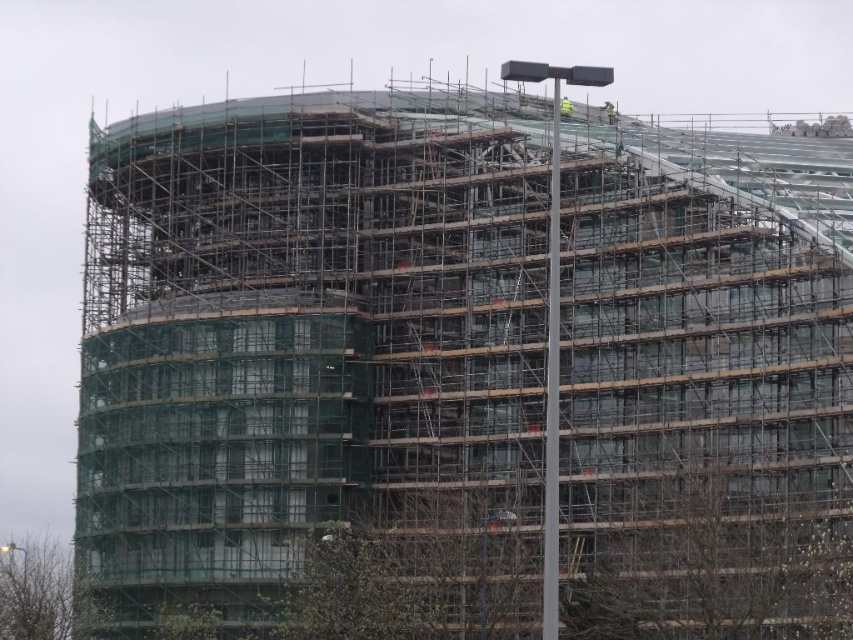
You are a construction worker looking to identify the location of your safety gear. You see the green safety helmet at upper center and the yellow reflective vest at upper center. Which item is located higher up?

The green safety helmet at upper center is positioned over the yellow reflective vest at upper center, so the helmet is higher up.

You are a construction inspector who needs to ensure that all safety gear is properly sized for workers. You observe the green safety helmet at upper center and the yellow reflective vest at upper center in the image. Which piece of safety equipment is larger in size?

The green safety helmet at upper center is bigger than the yellow reflective vest at upper center, so the helmet is the larger piece of safety equipment.

Based on the photo, you are an architect examining the construction site. You notice two points on the scaffolding labeled as point (614, 116) and point (569, 108). Which point is closer to your current position as you stand at the base of the building?

Point (614, 116) is further to the viewer than point (569, 108), so the point closer to your current position is point (569, 108).